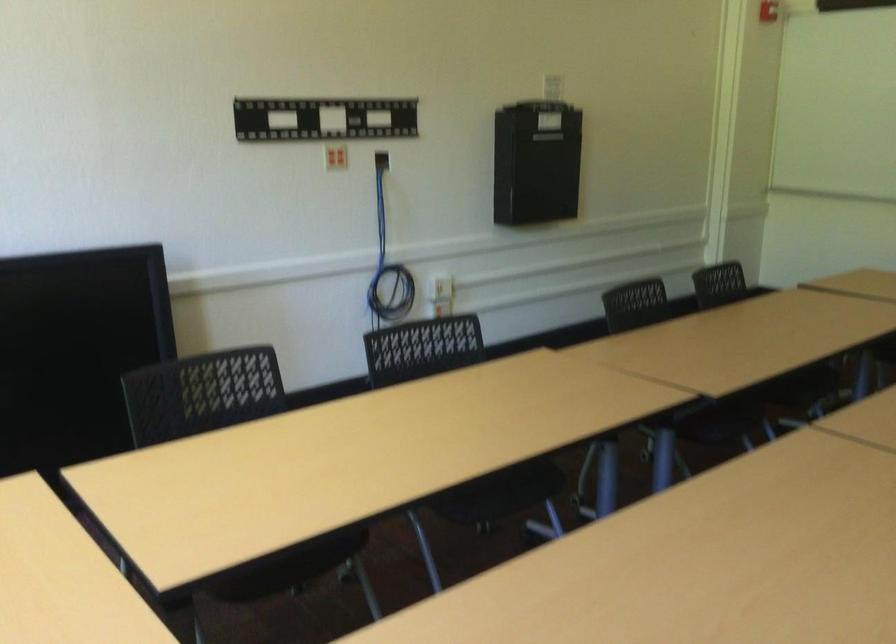
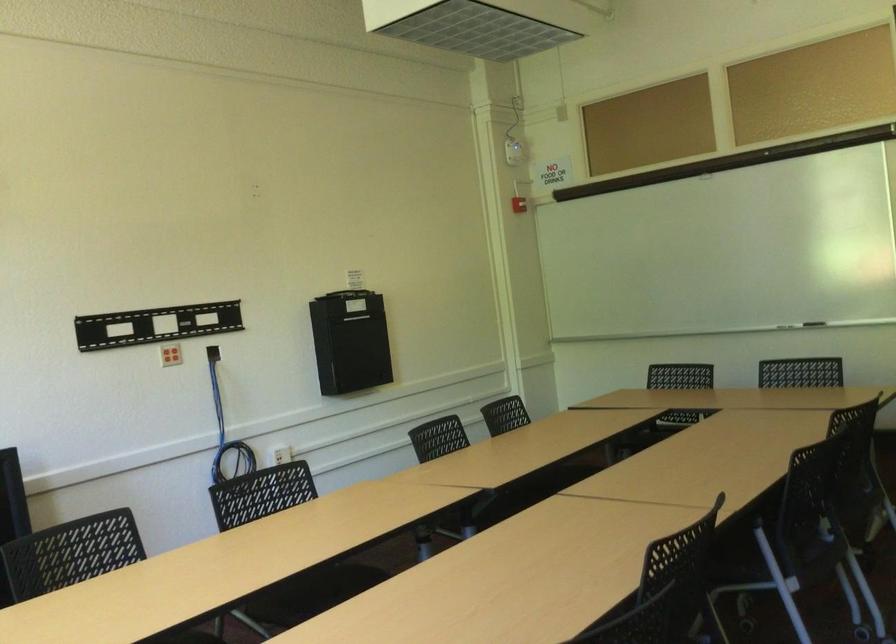
Find the pixel in the second image that matches [385,249] in the first image.

(226, 431)